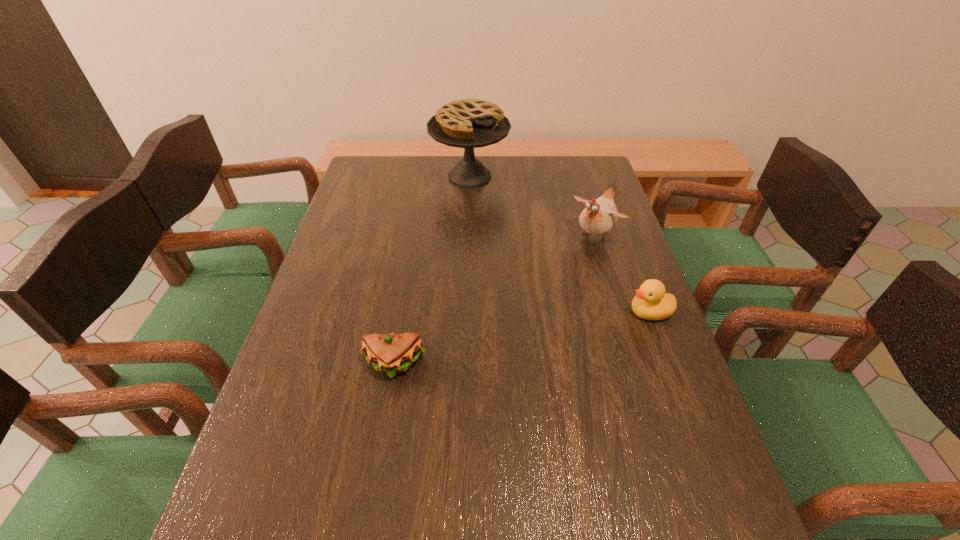
The height and width of the screenshot is (540, 960). I want to click on vacant region that satisfies the following two spatial constraints: 1. on the front side of the third shortest object; 2. on the face of the duckling, so click(618, 312).